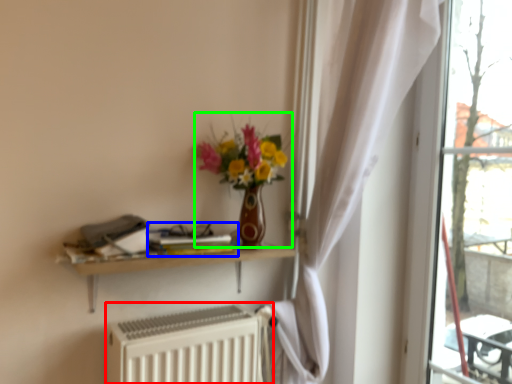
Question: Estimate the real-world distances between objects in this image. Which object is closer to radiator (highlighted by a red box), book (highlighted by a blue box) or floral arrangement (highlighted by a green box)?

Choices:
 (A) book
 (B) floral arrangement

Answer: (A)